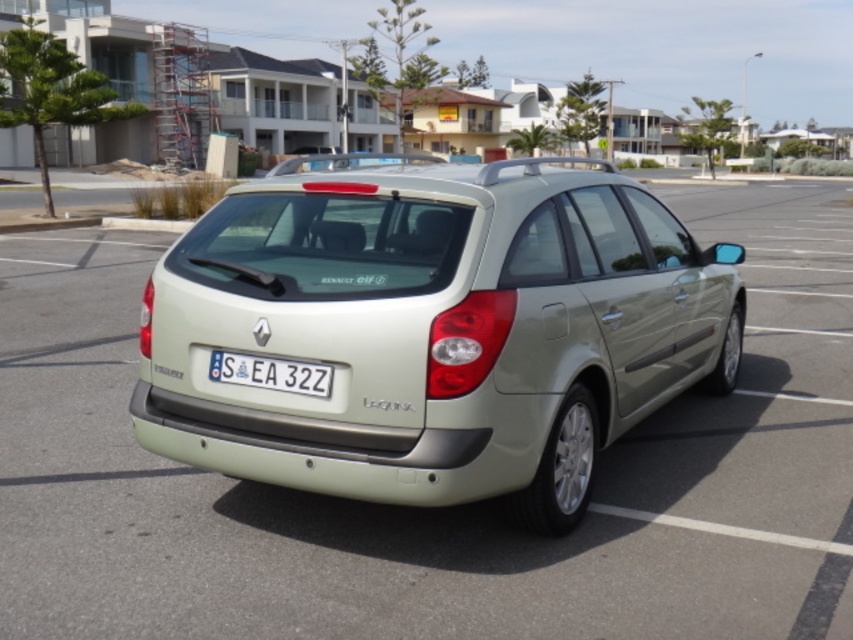
What do you see at coordinates (434, 330) in the screenshot?
I see `satin beige hatchback at center` at bounding box center [434, 330].

Looking at this image, can you confirm if satin beige hatchback at center is wider than white plastic license plate at center?

Indeed, satin beige hatchback at center has a greater width compared to white plastic license plate at center.

Which is in front, point (405, 476) or point (225, 376)?

Point (405, 476)

The width and height of the screenshot is (853, 640). What are the coordinates of `satin beige hatchback at center` in the screenshot? It's located at (434, 330).